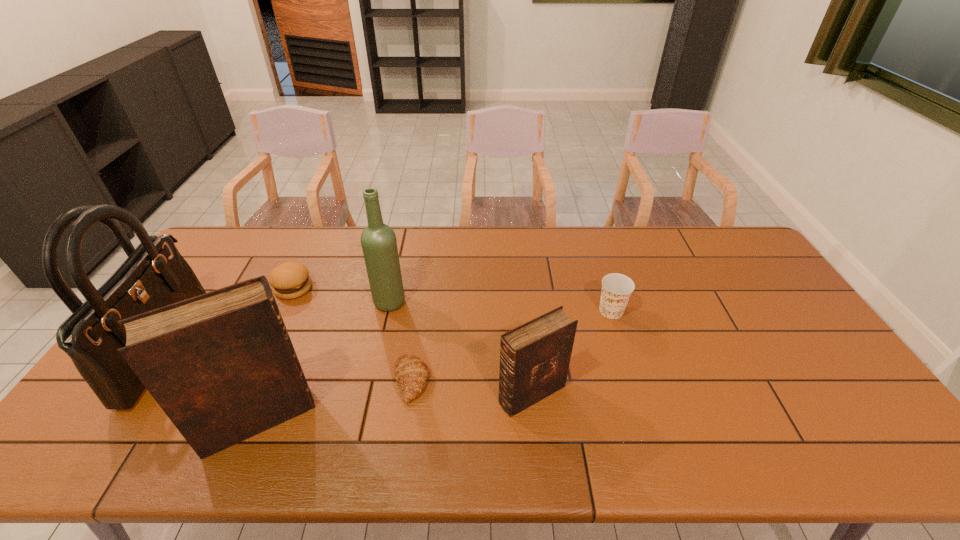
Where is `free point located on the left of the left Bible`? free point located on the left of the left Bible is located at coordinates (183, 419).

Where is `vacant space situated on the right of the shorter Bible`? The height and width of the screenshot is (540, 960). vacant space situated on the right of the shorter Bible is located at coordinates coord(598,394).

The image size is (960, 540). What are the coordinates of `vacant region located 0.170m on the front of the hamburger` in the screenshot? It's located at (268, 343).

The image size is (960, 540). Identify the location of vacant region located 0.140m on the back of the Dixie cup. (599, 272).

Find the location of a particular element. free spot located on the front of the fourth object from right to left is located at coordinates (381, 339).

Locate an element on the screen. free space located with an open clasp on the front of the handbag is located at coordinates (217, 345).

This screenshot has width=960, height=540. I want to click on free space located on the back of the crescent roll, so click(x=424, y=288).

Find the location of a particular element. The height and width of the screenshot is (540, 960). handbag located in the near edge section of the desktop is located at coordinates (154, 275).

Identify the location of crescent roll that is at the near edge. (411, 373).

You are a GUI agent. You are given a task and a screenshot of the screen. Output one action in this format:
    pyautogui.click(x=<x>, y=<y>)
    Task: Click on the object that is at the left edge
    Image resolution: width=960 pixels, height=540 pixels.
    Given the screenshot: What is the action you would take?
    pyautogui.click(x=154, y=275)